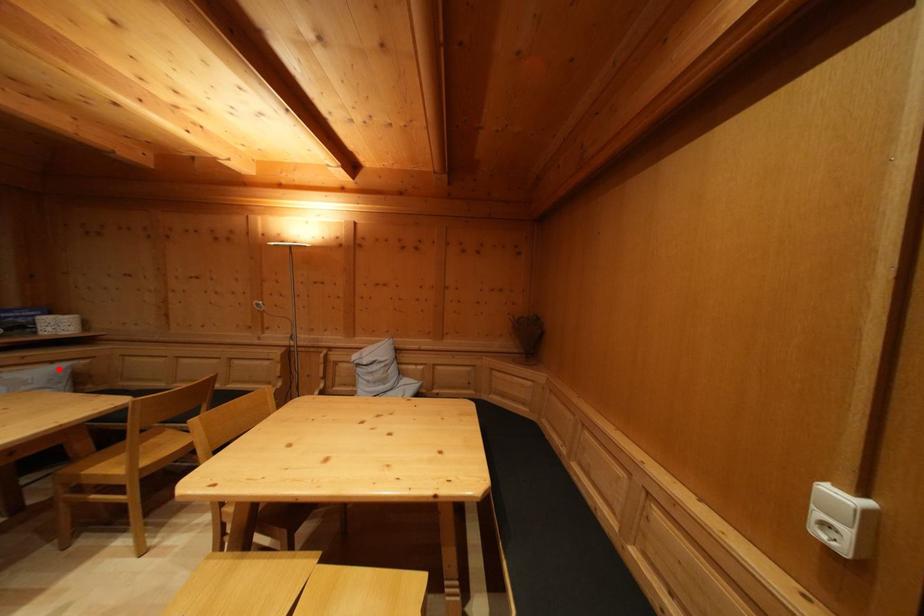
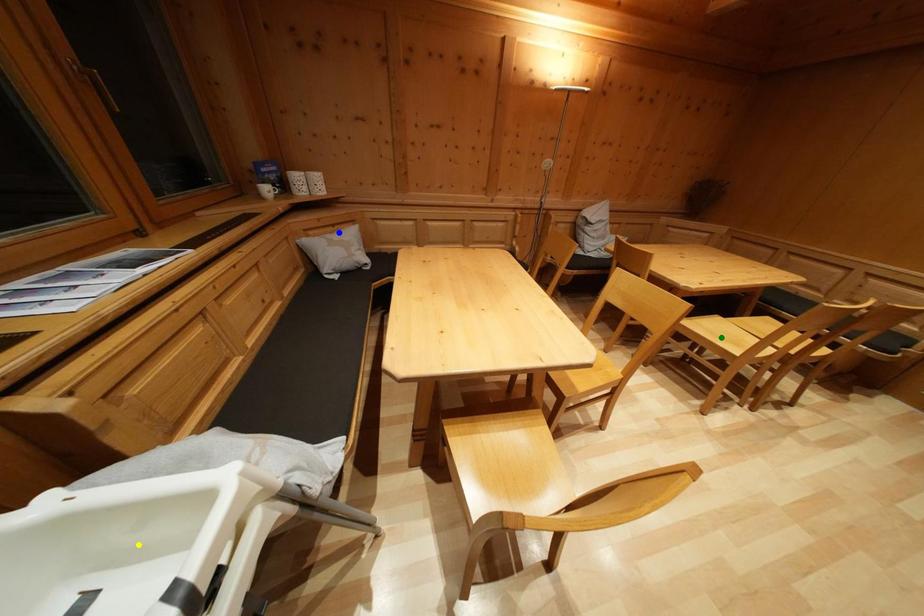
Question: I am providing you with two images of the same scene from different viewpoints. A red point is marked on the first image. You are given multiple points on the second image. Can you choose the point in image 2 that corresponds to the point in image 1?

Choices:
 (A) blue point
 (B) yellow point
 (C) green point

Answer: (A)